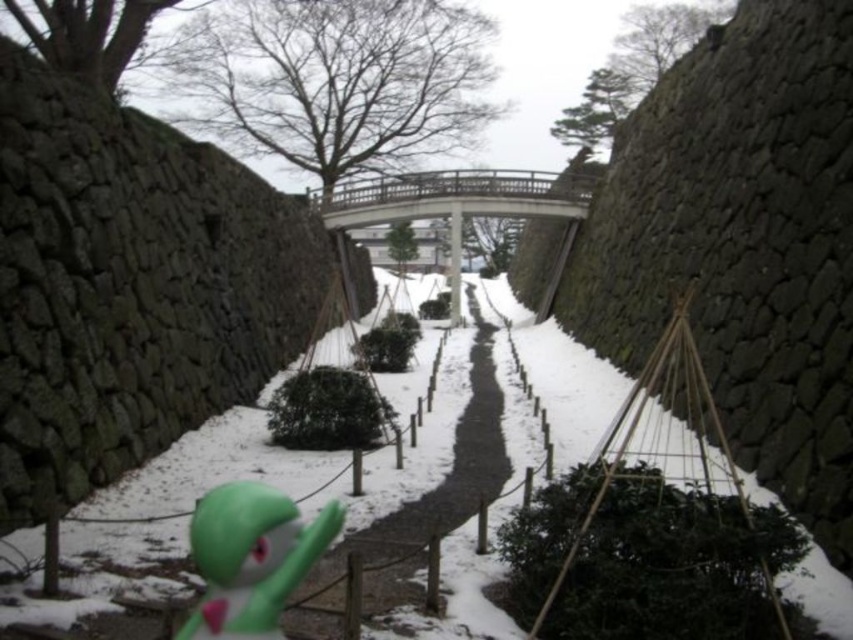
Question: Does snowy gravel path at center appear under green rubber toy at lower left?

Choices:
 (A) no
 (B) yes

Answer: (A)

Question: Does snowy gravel path at center have a greater width compared to green rubber toy at lower left?

Choices:
 (A) no
 (B) yes

Answer: (B)

Question: Is snowy gravel path at center wider than green rubber toy at lower left?

Choices:
 (A) no
 (B) yes

Answer: (B)

Question: Among these points, which one is farthest from the camera?

Choices:
 (A) (274, 547)
 (B) (445, 474)

Answer: (B)

Question: Which point appears farthest from the camera in this image?

Choices:
 (A) (213, 624)
 (B) (473, 296)

Answer: (B)

Question: Which point is closer to the camera?

Choices:
 (A) snowy gravel path at center
 (B) green rubber toy at lower left

Answer: (B)